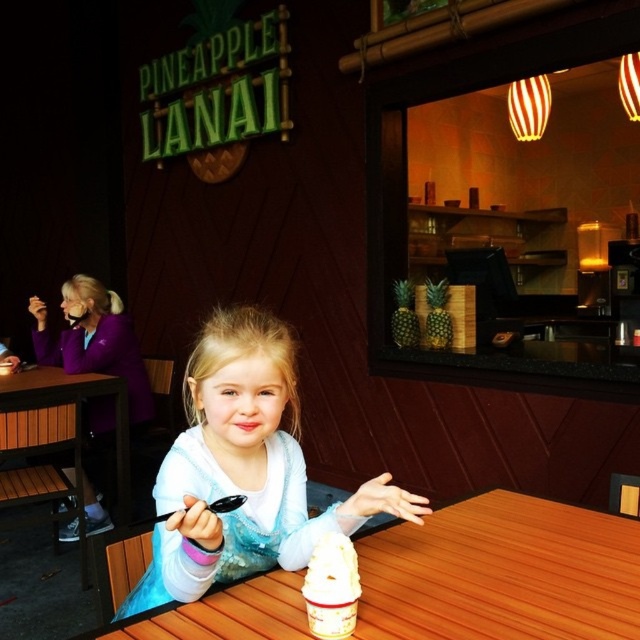
You are a photographer standing at the entrance of Pineapple Lanai. You need to take a photo of the white satin dress at center and the brown wooden table at lower left. The minimum distance required for your camera to focus on both objects clearly is 2 meters. Can you capture both objects in focus from your current position?

The white satin dress at center is 1.83 meters away from the brown wooden table at lower left. Since the required minimum distance for the camera to focus on both objects is 2 meters, you are too close to capture both in focus. Move back to increase the distance between you and the subjects to at least 2 meters.

You are a photographer setting up for a photoshoot at Pineapple Lanai. You need to position a 1.5 meter tall tripod between the wooden table at center and the white satin dress at center. Will the tripod fit vertically between them without touching either object?

The wooden table at center is not as tall as the white satin dress at center. Since the tripod is 1.5 meters tall, it may not fit vertically between them if the white satin dress at center is taller than the tripod. However, the exact height of the dress isn

You are a photographer setting up for a photoshoot at Pineapple Lanai. You need to position a light to the left of the white satin dress at center. Will the wooden table at center block the light from reaching the dress?

The wooden table at center is to the right of the white satin dress at center, so placing the light to the left of the dress would not be blocked by the table.